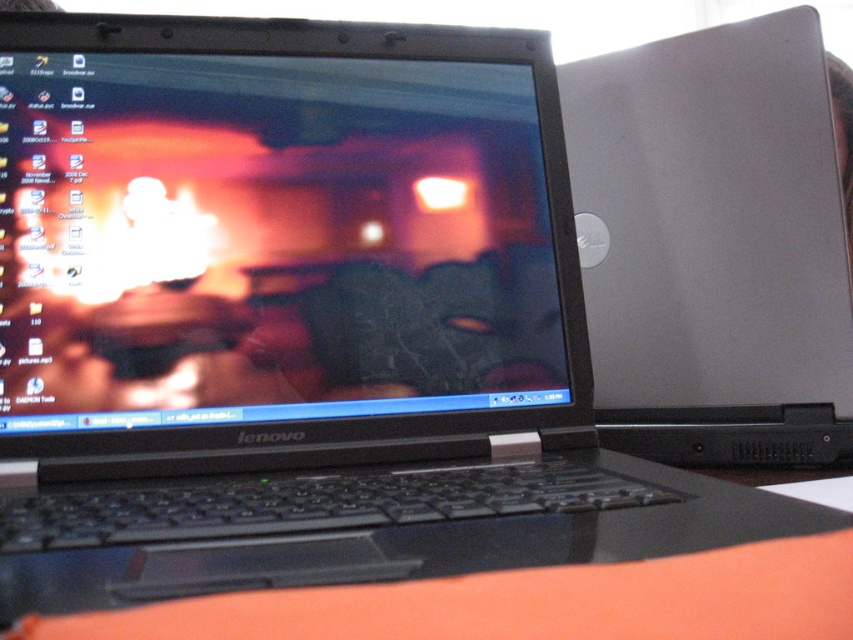
You are organizing a desk and need to place a new item between the matte black laptop at center and the orange fabric at lower center. Based on their current positions, where should you place the new item?

The new item should be placed between the matte black laptop at center and the orange fabric at lower center, as the matte black laptop at center is on the left side of the orange fabric at lower center.

You are organizing a workspace and need to place a new item between the silver metallic laptop at right and the orange fabric at lower center. Based on their positions, where should you place the new item?

The silver metallic laptop at right is located above the orange fabric at lower center, so you should place the new item between them either below the silver metallic laptop at right and above the orange fabric at lower center.